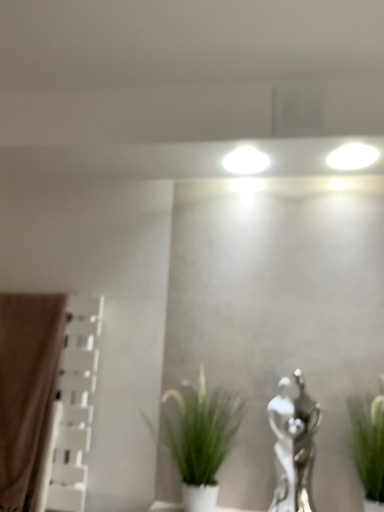
Question: From the image's perspective, is green leafy plant at right, marked as the 2th houseplant in a left-to-right arrangement, on top of brown fabric curtain at left?

Choices:
 (A) no
 (B) yes

Answer: (A)

Question: Does green leafy plant at right, marked as the 2th houseplant in a left-to-right arrangement, have a greater width compared to brown fabric curtain at left?

Choices:
 (A) yes
 (B) no

Answer: (A)

Question: Can you confirm if green leafy plant at right, arranged as the first houseplant when viewed from the right, is taller than brown fabric curtain at left?

Choices:
 (A) no
 (B) yes

Answer: (A)

Question: Is brown fabric curtain at left a part of green leafy plant at right, arranged as the first houseplant when viewed from the right?

Choices:
 (A) yes
 (B) no

Answer: (B)

Question: Is green leafy plant at right, marked as the 2th houseplant in a left-to-right arrangement, not inside brown fabric curtain at left?

Choices:
 (A) no
 (B) yes

Answer: (B)

Question: From the image's perspective, relative to brown fabric curtain at left, is silver metallic statue at center-right above or below?

Choices:
 (A) above
 (B) below

Answer: (B)

Question: Based on their positions, is silver metallic statue at center-right located to the left or right of brown fabric curtain at left?

Choices:
 (A) right
 (B) left

Answer: (A)

Question: Considering the positions of silver metallic statue at center-right and brown fabric curtain at left in the image, is silver metallic statue at center-right wider or thinner than brown fabric curtain at left?

Choices:
 (A) thin
 (B) wide

Answer: (A)

Question: Choose the correct answer: Is silver metallic statue at center-right inside brown fabric curtain at left or outside it?

Choices:
 (A) inside
 (B) outside

Answer: (B)

Question: From the image's perspective, is green leafy plant at right, arranged as the first houseplant when viewed from the right, located above or below green matte plant at center, arranged as the second houseplant when viewed from the right?

Choices:
 (A) above
 (B) below

Answer: (A)

Question: Is green leafy plant at right, marked as the 2th houseplant in a left-to-right arrangement, inside or outside of green matte plant at center, the first houseplant when ordered from left to right?

Choices:
 (A) inside
 (B) outside

Answer: (B)

Question: In terms of size, does green leafy plant at right, marked as the 2th houseplant in a left-to-right arrangement, appear bigger or smaller than green matte plant at center, the first houseplant when ordered from left to right?

Choices:
 (A) small
 (B) big

Answer: (A)

Question: Considering the relative positions of green leafy plant at right, arranged as the first houseplant when viewed from the right, and green matte plant at center, the first houseplant when ordered from left to right, in the image provided, is green leafy plant at right, arranged as the first houseplant when viewed from the right, to the left or to the right of green matte plant at center, the first houseplant when ordered from left to right,?

Choices:
 (A) left
 (B) right

Answer: (B)

Question: From a real-world perspective, is green leafy plant at right, arranged as the first houseplant when viewed from the right, physically located above or below silver metallic statue at center-right?

Choices:
 (A) below
 (B) above

Answer: (B)

Question: From their relative heights in the image, would you say green leafy plant at right, arranged as the first houseplant when viewed from the right, is taller or shorter than silver metallic statue at center-right?

Choices:
 (A) short
 (B) tall

Answer: (A)